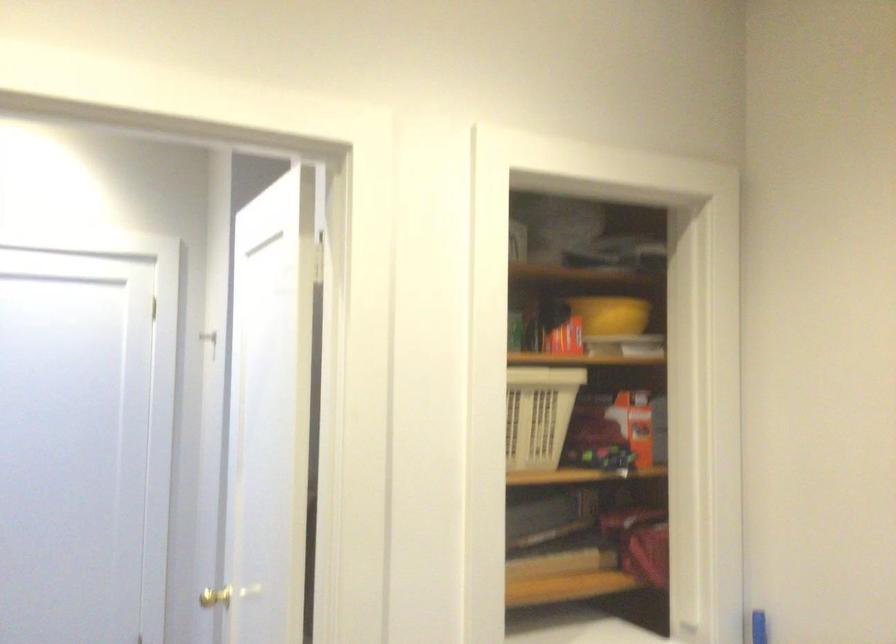
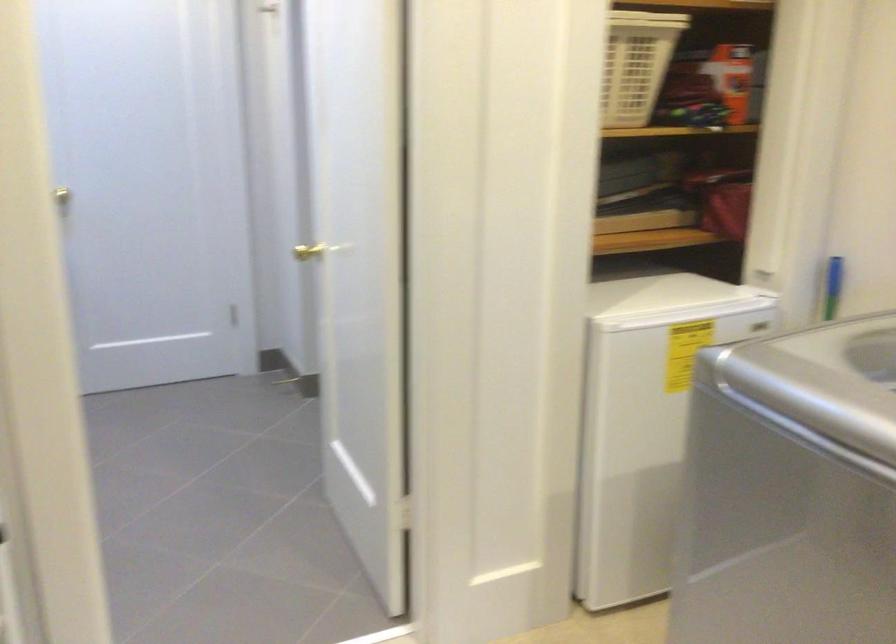
Locate, in the second image, the point that corresponds to point (544, 413) in the first image.

(636, 64)